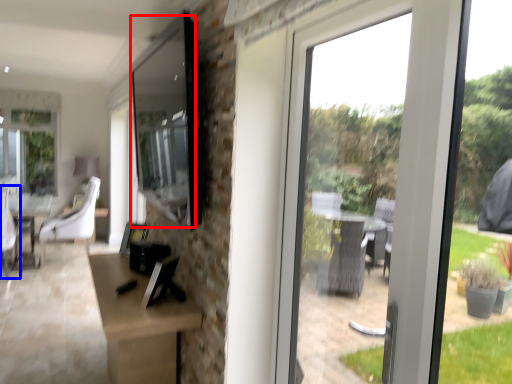
Question: Which object appears closest to the camera in this image, window screen (highlighted by a red box) or swivel chair (highlighted by a blue box)?

Choices:
 (A) window screen
 (B) swivel chair

Answer: (A)